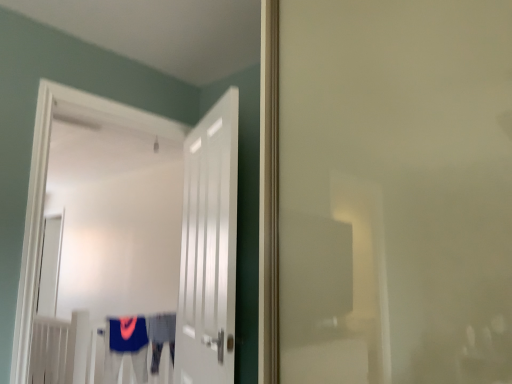
Question: Is blue fabric robe at lower center, which appears as the 1th robe when viewed from the left, facing away from white glossy door at center, which is the 2th door in left-to-right order?

Choices:
 (A) no
 (B) yes

Answer: (A)

Question: Does blue fabric robe at lower center, the 2th robe in the right-to-left sequence, appear on the right side of white glossy door at center, which is the 2th door in left-to-right order?

Choices:
 (A) yes
 (B) no

Answer: (B)

Question: Considering the relative sizes of blue fabric robe at lower center, which appears as the 1th robe when viewed from the left, and white glossy door at center, the first door viewed from the right, in the image provided, is blue fabric robe at lower center, which appears as the 1th robe when viewed from the left, smaller than white glossy door at center, the first door viewed from the right,?

Choices:
 (A) no
 (B) yes

Answer: (B)

Question: Can you confirm if blue fabric robe at lower center, the 2th robe in the right-to-left sequence, is positioned to the left of white glossy door at center, which is the 2th door in left-to-right order?

Choices:
 (A) yes
 (B) no

Answer: (A)

Question: Is blue fabric robe at lower center, which appears as the 1th robe when viewed from the left, wider than white glossy door at center, which is the 2th door in left-to-right order?

Choices:
 (A) no
 (B) yes

Answer: (B)

Question: Is blue fabric robe at lower center, the 2th robe in the right-to-left sequence, in contact with white glossy door at center, the first door viewed from the right?

Choices:
 (A) yes
 (B) no

Answer: (B)

Question: From the image's perspective, is white glossy door at center, the 2th door from the right, located beneath blue fabric robe at lower center, which appears as the 1th robe when viewed from the left?

Choices:
 (A) no
 (B) yes

Answer: (A)

Question: Does white glossy door at center, the 2th door from the right, appear on the right side of blue fabric robe at lower center, which appears as the 1th robe when viewed from the left?

Choices:
 (A) no
 (B) yes

Answer: (B)

Question: Is white glossy door at center, acting as the first door starting from the left, looking in the opposite direction of blue fabric robe at lower center, the 2th robe in the right-to-left sequence?

Choices:
 (A) yes
 (B) no

Answer: (B)

Question: Is white glossy door at center, the 2th door from the right, taller than blue fabric robe at lower center, the 2th robe in the right-to-left sequence?

Choices:
 (A) yes
 (B) no

Answer: (A)

Question: Could you tell me if white glossy door at center, acting as the first door starting from the left, is facing blue fabric robe at lower center, the 2th robe in the right-to-left sequence?

Choices:
 (A) no
 (B) yes

Answer: (A)

Question: From a real-world perspective, is white glossy door at center, the 2th door from the right, beneath blue fabric robe at lower center, which appears as the 1th robe when viewed from the left?

Choices:
 (A) yes
 (B) no

Answer: (B)

Question: Considering the relative positions of white glossy door at center, acting as the first door starting from the left, and blue fabric robe at center, the first robe from the right, in the image provided, is white glossy door at center, acting as the first door starting from the left, to the left of blue fabric robe at center, the first robe from the right, from the viewer's perspective?

Choices:
 (A) yes
 (B) no

Answer: (B)